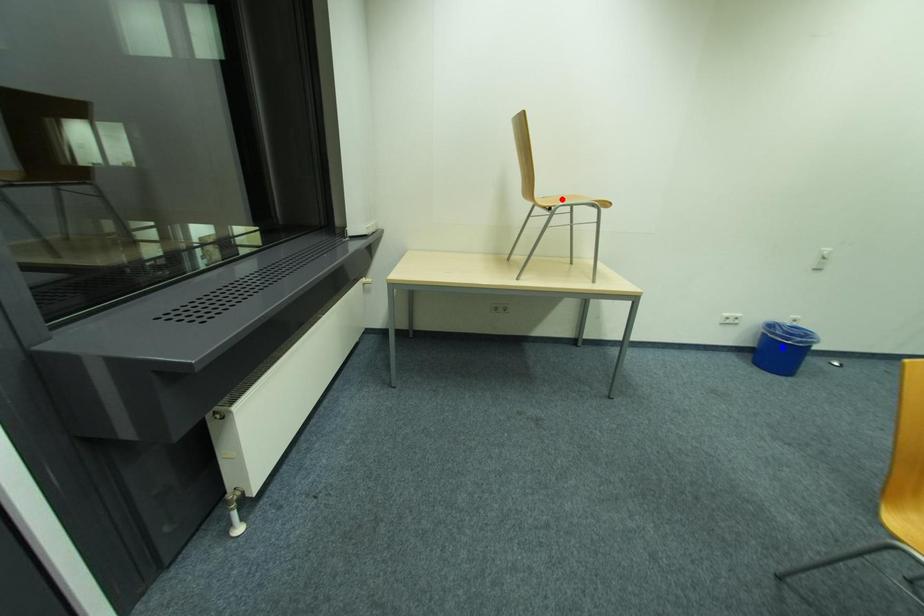
Question: In the image, two points are highlighted. Which point is nearer to the camera? Reply with the corresponding letter.

Choices:
 (A) blue point
 (B) red point

Answer: (B)